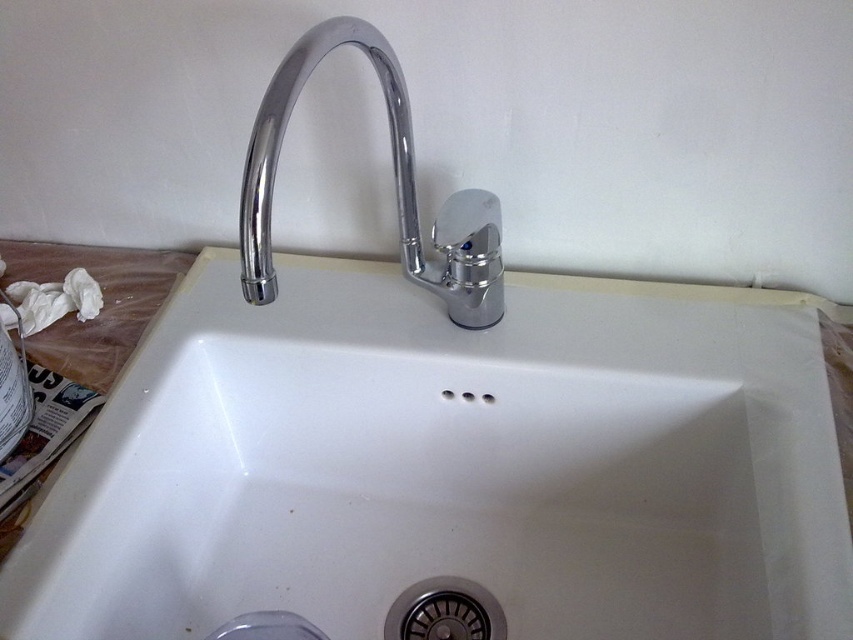
You are trying to install a new faucet and need to know the distance between the white ceramic sink at center and the polished chrome faucet at center. Is it more than 20 centimeters?

The white ceramic sink at center is 19.74 centimeters away from the polished chrome faucet at center, so the distance is less than 20 centimeters.

You are a plumber inspecting a bathroom sink. You notice the white ceramic sink at center and the polished chrome faucet at center. Based on their positions, which one is located to the right of the other?

The white ceramic sink at center is to the right of the polished chrome faucet at center.

From the picture: You are trying to locate the white ceramic sink at center in the image. What are its coordinates?

The white ceramic sink at center is located at coordinates point [451,465].